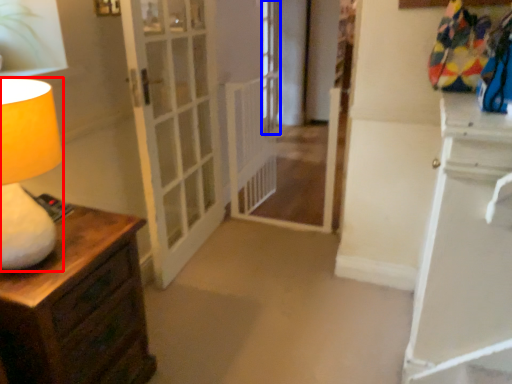
Question: Which point is closer to the camera, table lamp (highlighted by a red box) or window (highlighted by a blue box)?

Choices:
 (A) table lamp
 (B) window

Answer: (A)